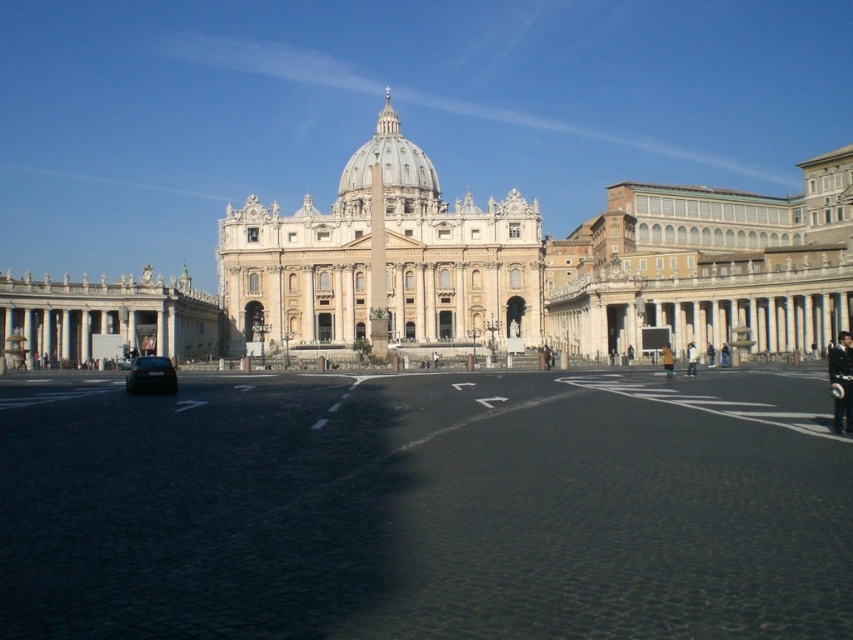
Is point (804, 323) farther from viewer compared to point (671, 376)?

No.

Between point (662, 269) and point (669, 349), which one is positioned behind?

The point (662, 269) is more distant.

Locate an element on the screen. The image size is (853, 640). beige stone columns at right is located at coordinates click(x=708, y=268).

Does white marble dome at center have a lesser height compared to dark blue jeans at center?

In fact, white marble dome at center may be taller than dark blue jeans at center.

The width and height of the screenshot is (853, 640). Describe the element at coordinates (389, 163) in the screenshot. I see `white marble dome at center` at that location.

Where is `white marble dome at center`? white marble dome at center is located at coordinates (389, 163).

Image resolution: width=853 pixels, height=640 pixels. In order to click on white marble dome at center in this screenshot , I will do `click(389, 163)`.

The image size is (853, 640). What do you see at coordinates (381, 257) in the screenshot?
I see `golden stone palace at center` at bounding box center [381, 257].

Does golden stone palace at center appear on the right side of white marble dome at center?

Incorrect, golden stone palace at center is not on the right side of white marble dome at center.

The image size is (853, 640). Identify the location of golden stone palace at center. (381, 257).